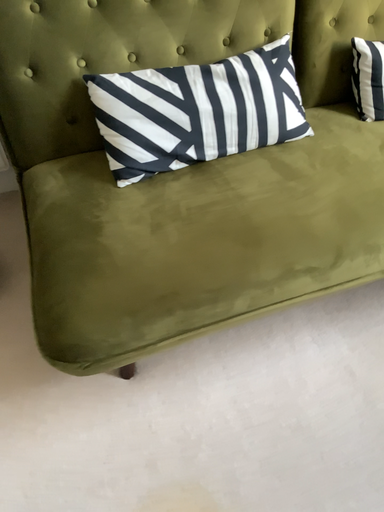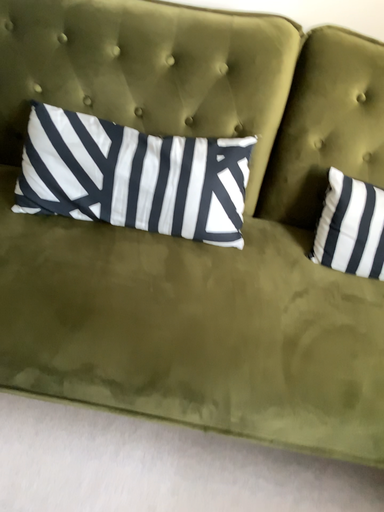
Question: Which way did the camera rotate in the video?

Choices:
 (A) rotated right
 (B) rotated left

Answer: (B)